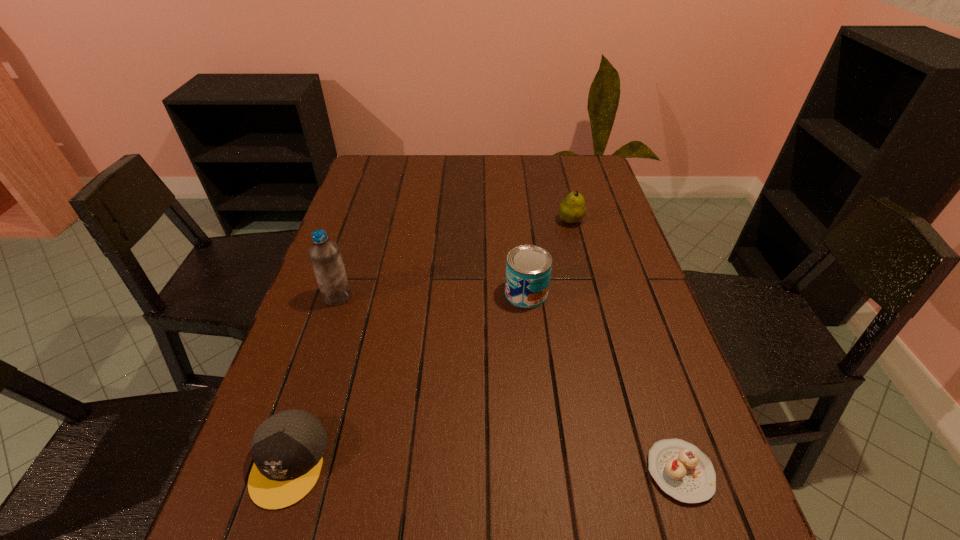
Where is `vacant space in between the tallest object and the pear`? vacant space in between the tallest object and the pear is located at coordinates (454, 259).

What are the coordinates of `vacant point located between the water bottle and the fourth tallest object` in the screenshot? It's located at (313, 379).

Image resolution: width=960 pixels, height=540 pixels. In order to click on free space between the water bottle and the can in this screenshot , I will do `click(432, 295)`.

Image resolution: width=960 pixels, height=540 pixels. In order to click on free space between the cap and the shortest object in this screenshot , I will do `click(485, 467)`.

Locate an element on the screen. The height and width of the screenshot is (540, 960). free area in between the cap and the tallest object is located at coordinates (313, 379).

Locate an element on the screen. The height and width of the screenshot is (540, 960). vacant space in between the pear and the cupcake is located at coordinates (625, 346).

Where is `object identified as the third closest to the farthest object`? Image resolution: width=960 pixels, height=540 pixels. object identified as the third closest to the farthest object is located at coordinates (681, 470).

Identify the location of object that is the second closest one to the water bottle. (528, 268).

Where is `free space that satisfies the following two spatial constraints: 1. on the front side of the water bottle; 2. on the right side of the cupcake`? free space that satisfies the following two spatial constraints: 1. on the front side of the water bottle; 2. on the right side of the cupcake is located at coordinates (279, 471).

You are a GUI agent. You are given a task and a screenshot of the screen. Output one action in this format:
    pyautogui.click(x=<x>, y=<y>)
    Task: Click on the vacant position in the image that satisfies the following two spatial constraints: 1. on the back side of the third object from right to left; 2. on the right side of the farthest object
    Image resolution: width=960 pixels, height=540 pixels.
    Given the screenshot: What is the action you would take?
    pyautogui.click(x=518, y=221)